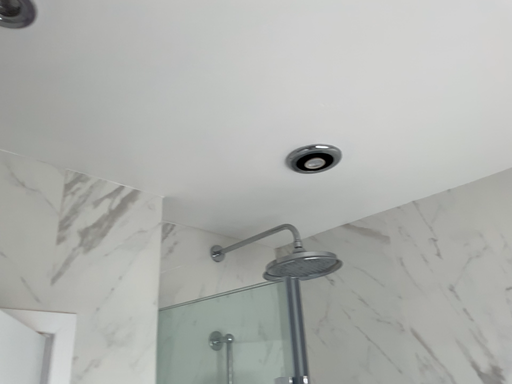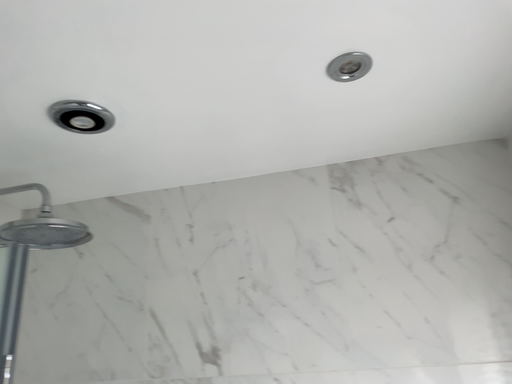
Question: Which way did the camera rotate in the video?

Choices:
 (A) rotated left
 (B) rotated right

Answer: (B)